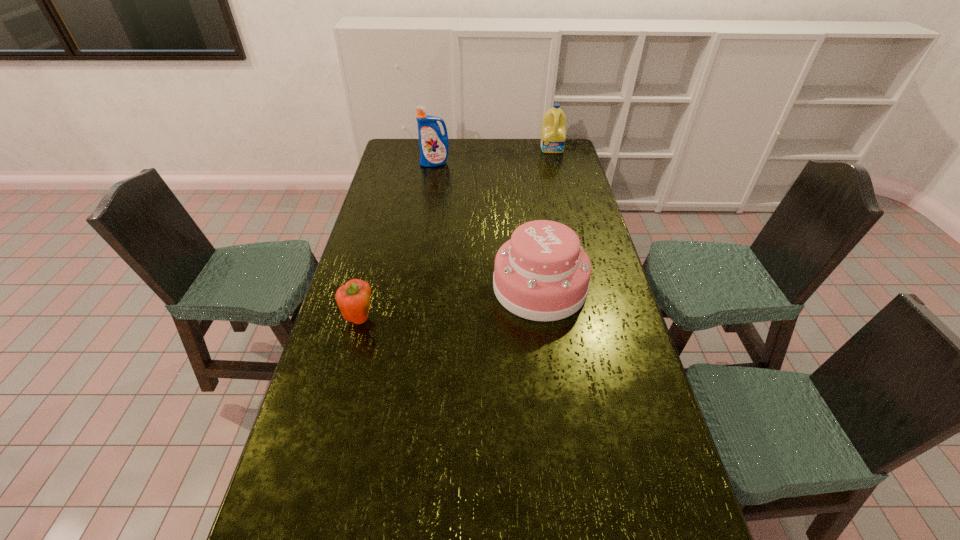
Where is `free space located 0.170m on the right of the shortest object`? This screenshot has height=540, width=960. free space located 0.170m on the right of the shortest object is located at coordinates [x=429, y=319].

Locate an element on the screen. The image size is (960, 540). object that is positioned at the left edge is located at coordinates (354, 298).

Find the location of a particular element. detergent present at the right edge is located at coordinates (553, 132).

At what (x,y) coordinates should I click in order to perform the action: click on cake that is positioned at the right edge. Please return your answer as a coordinate pair (x, y). The image size is (960, 540). Looking at the image, I should click on (542, 273).

Where is `object located at the far right corner`? The image size is (960, 540). object located at the far right corner is located at coordinates (553, 132).

Identify the location of vacant space at the far edge of the desktop. Image resolution: width=960 pixels, height=540 pixels. (496, 149).

Where is `vacant space at the left edge`? The height and width of the screenshot is (540, 960). vacant space at the left edge is located at coordinates (373, 192).

This screenshot has width=960, height=540. I want to click on vacant space at the right edge of the desktop, so click(573, 176).

What are the coordinates of `vacant area between the left detergent and the leftmost object` in the screenshot? It's located at (397, 241).

The image size is (960, 540). What are the coordinates of `free point between the farthest object and the leftmost object` in the screenshot? It's located at (456, 234).